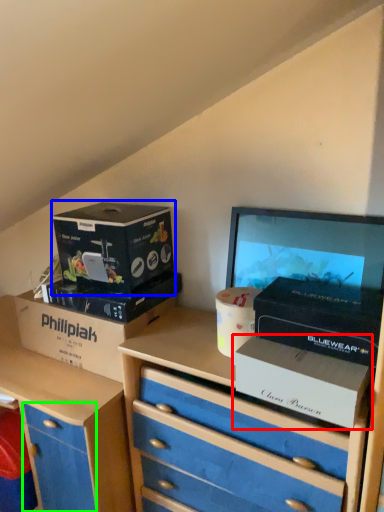
Question: Based on their relative distances, which object is farther from box (highlighted by a red box)? Choose from box (highlighted by a blue box) and drawer (highlighted by a green box).

Choices:
 (A) box
 (B) drawer

Answer: (B)